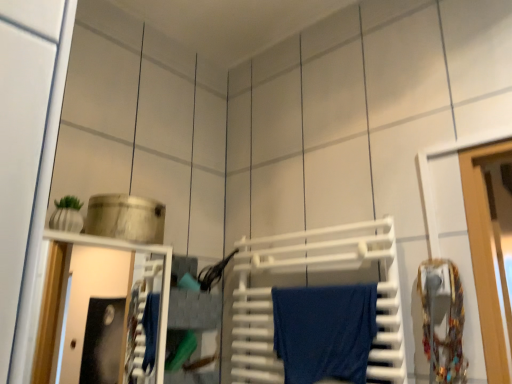
Question: Is blue cotton towel at center far away from white plastic towel rack at center?

Choices:
 (A) yes
 (B) no

Answer: (B)

Question: Considering the relative sizes of blue cotton towel at center and white plastic towel rack at center in the image provided, is blue cotton towel at center thinner than white plastic towel rack at center?

Choices:
 (A) no
 (B) yes

Answer: (A)

Question: Considering the relative sizes of blue cotton towel at center and white plastic towel rack at center in the image provided, is blue cotton towel at center wider than white plastic towel rack at center?

Choices:
 (A) yes
 (B) no

Answer: (A)

Question: Is blue cotton towel at center aimed at white plastic towel rack at center?

Choices:
 (A) no
 (B) yes

Answer: (B)

Question: Is blue cotton towel at center with white plastic towel rack at center?

Choices:
 (A) yes
 (B) no

Answer: (A)

Question: From a real-world perspective, is blue cotton towel at center located beneath white plastic towel rack at center?

Choices:
 (A) yes
 (B) no

Answer: (A)

Question: From a real-world perspective, is white plastic towel rack at center located higher than blue cotton towel at center?

Choices:
 (A) yes
 (B) no

Answer: (A)

Question: Can you confirm if white plastic towel rack at center is shorter than blue cotton towel at center?

Choices:
 (A) yes
 (B) no

Answer: (B)

Question: Is white plastic towel rack at center outside blue cotton towel at center?

Choices:
 (A) yes
 (B) no

Answer: (B)

Question: Can you confirm if white plastic towel rack at center is wider than blue cotton towel at center?

Choices:
 (A) no
 (B) yes

Answer: (A)

Question: Is the depth of white plastic towel rack at center less than that of blue cotton towel at center?

Choices:
 (A) yes
 (B) no

Answer: (A)

Question: From a real-world perspective, is white plastic towel rack at center below blue cotton towel at center?

Choices:
 (A) no
 (B) yes

Answer: (A)

Question: Do you think blue cotton towel at center is within white plastic towel rack at center, or outside of it?

Choices:
 (A) inside
 (B) outside

Answer: (A)